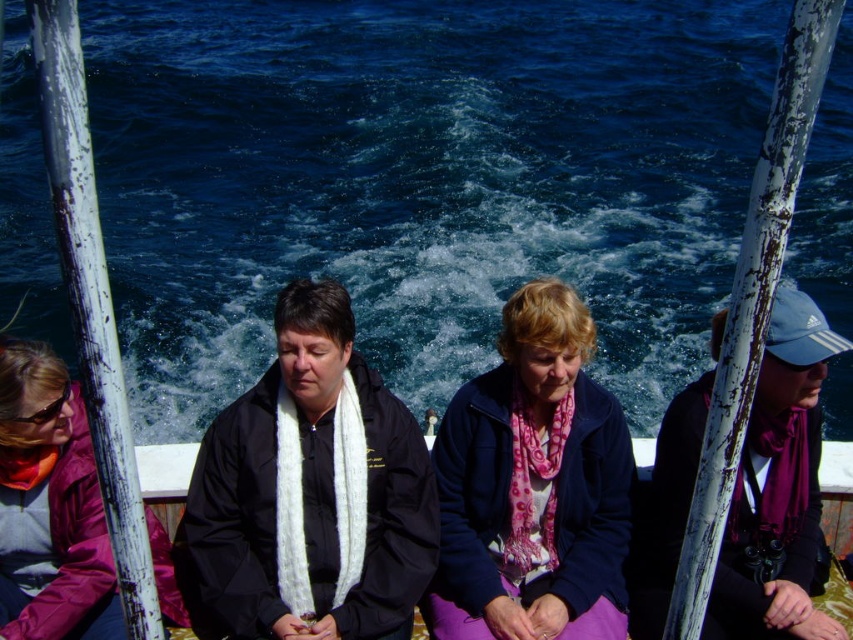
You are navigating a small drone that needs to capture a closeup of the blue water at center. According to the coordinates provided, where should the drone focus its camera?

The blue water at center is located at point (419, 180), so the drone should focus its camera there.